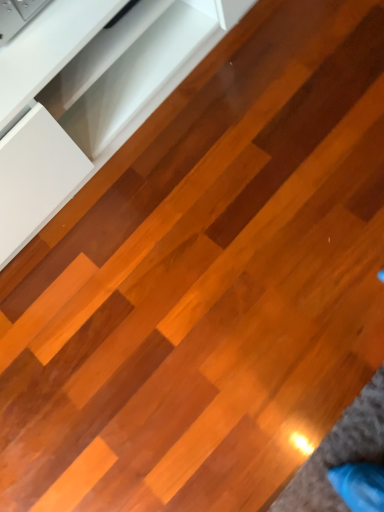
Where is `glossy wood floor at upper left`? Image resolution: width=384 pixels, height=512 pixels. glossy wood floor at upper left is located at coordinates (103, 116).

What do you see at coordinates (103, 116) in the screenshot? The image size is (384, 512). I see `glossy wood floor at upper left` at bounding box center [103, 116].

Locate an element on the screen. glossy wood floor at upper left is located at coordinates (103, 116).